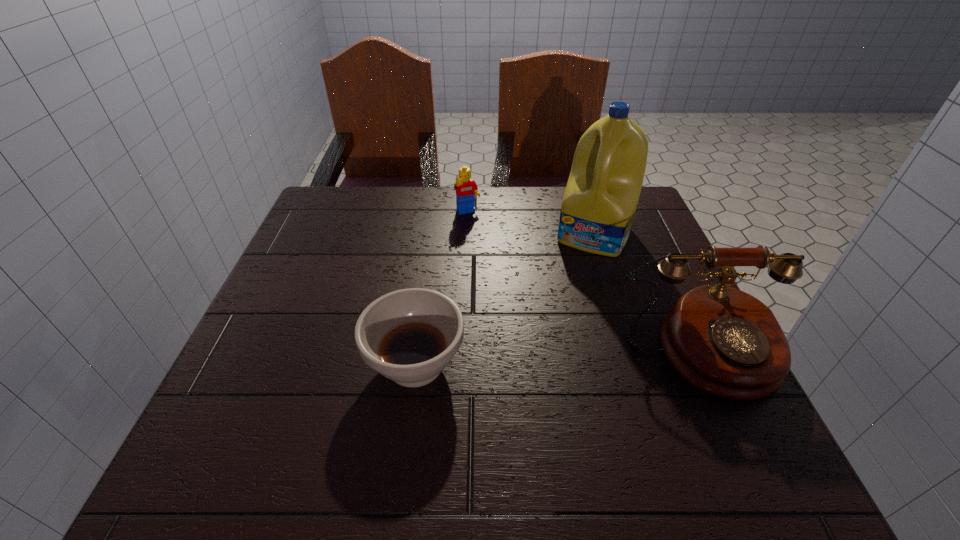
Image resolution: width=960 pixels, height=540 pixels. In order to click on free space located on the face of the third tallest object in this screenshot , I will do `click(504, 274)`.

This screenshot has height=540, width=960. I want to click on detergent situated at the far edge, so click(599, 204).

Where is `Lego that is at the far edge`? The width and height of the screenshot is (960, 540). Lego that is at the far edge is located at coordinates (466, 188).

Where is `soup bowl located at the near edge`? The image size is (960, 540). soup bowl located at the near edge is located at coordinates (409, 336).

You are a GUI agent. You are given a task and a screenshot of the screen. Output one action in this format:
    pyautogui.click(x=<x>, y=<y>)
    Task: Click on the telephone present at the near edge
    The image size is (960, 540).
    Given the screenshot: What is the action you would take?
    pyautogui.click(x=725, y=342)

This screenshot has width=960, height=540. In order to click on telephone that is at the right edge in this screenshot , I will do `click(725, 342)`.

Image resolution: width=960 pixels, height=540 pixels. Identify the location of detergent at the right edge. (599, 204).

Find the location of a particular element. object that is at the far right corner is located at coordinates (599, 204).

Locate an element on the screen. The height and width of the screenshot is (540, 960). object situated at the near right corner is located at coordinates (725, 342).

In the image, there is a desktop. Identify the location of vacant area at the far edge. (431, 187).